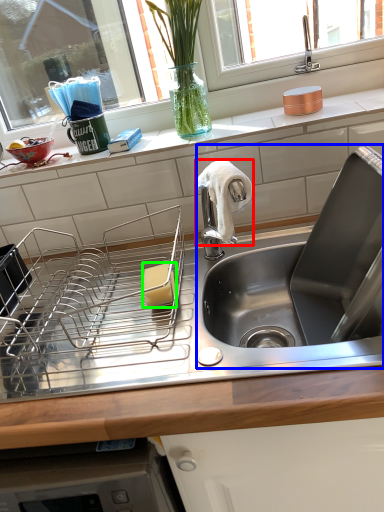
Question: Based on their relative distances, which object is farther from cloth (highlighted by a red box)? Choose from sink (highlighted by a blue box) and food (highlighted by a green box).

Choices:
 (A) sink
 (B) food

Answer: (A)